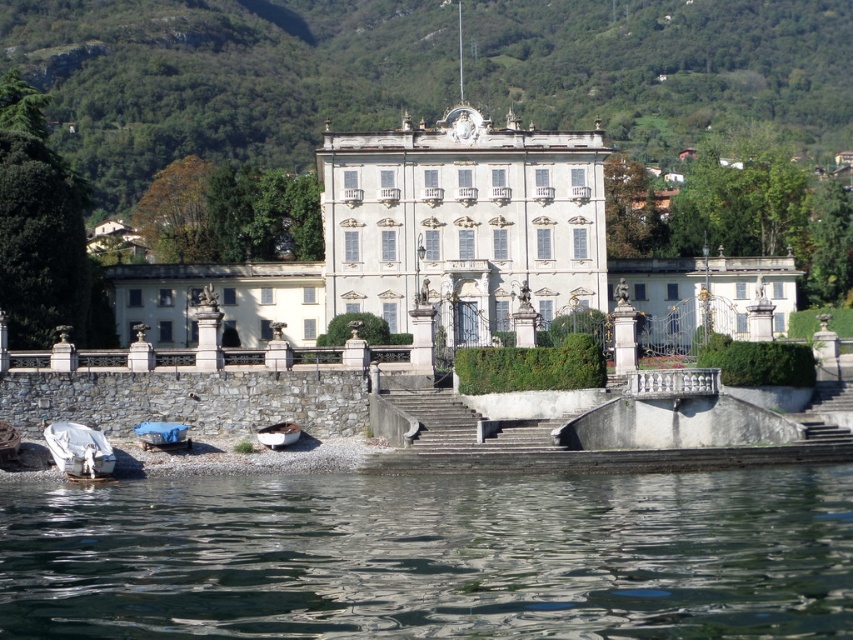
You are standing at the edge of the villa and want to reach the entrance. The entrance is located at the center of the villa. Based on the image, where are the gray concrete stairs at center in relation to the entrance?

The gray concrete stairs at center are located at point (579, 444), which is near the entrance since the entrance is at the center of the villa.

You are a visitor approaching the villa and see the gray concrete stairs at center and the gray concrete stairs at lower center. Which set of stairs is closer to the entrance of the villa?

The gray concrete stairs at center is positioned over the gray concrete stairs at lower center, so the gray concrete stairs at center is closer to the entrance of the villa.